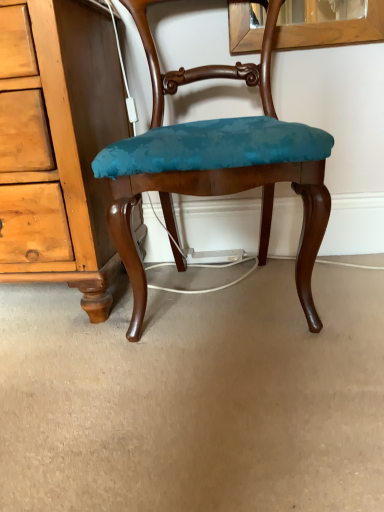
What do you see at coordinates (216, 164) in the screenshot? I see `teal velvet cushion at center` at bounding box center [216, 164].

Image resolution: width=384 pixels, height=512 pixels. I want to click on teal velvet cushion at center, so click(x=216, y=164).

Where is `teal velvet cushion at center`? This screenshot has width=384, height=512. teal velvet cushion at center is located at coordinates click(x=216, y=164).